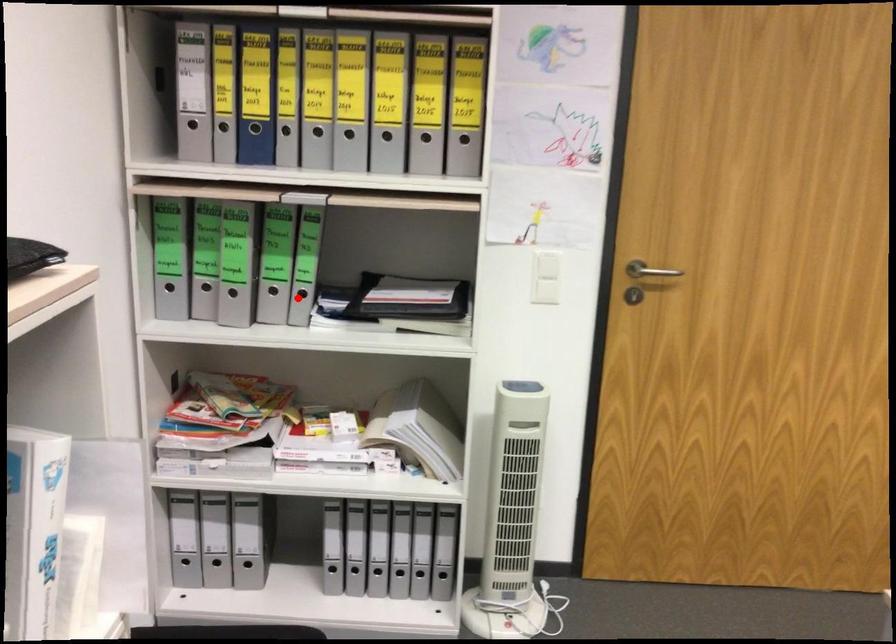
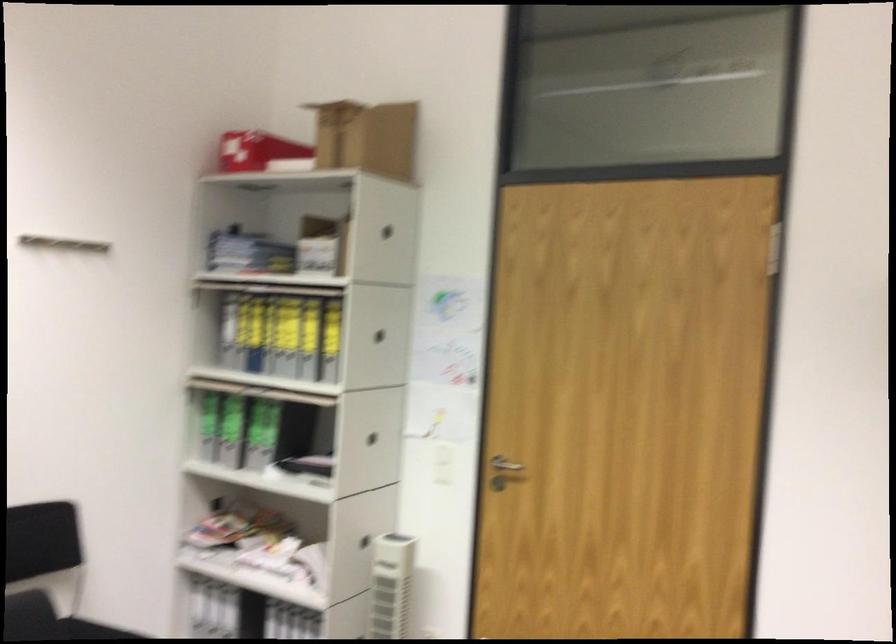
In the second image, find the point that corresponds to the highlighted location in the first image.

(265, 453)